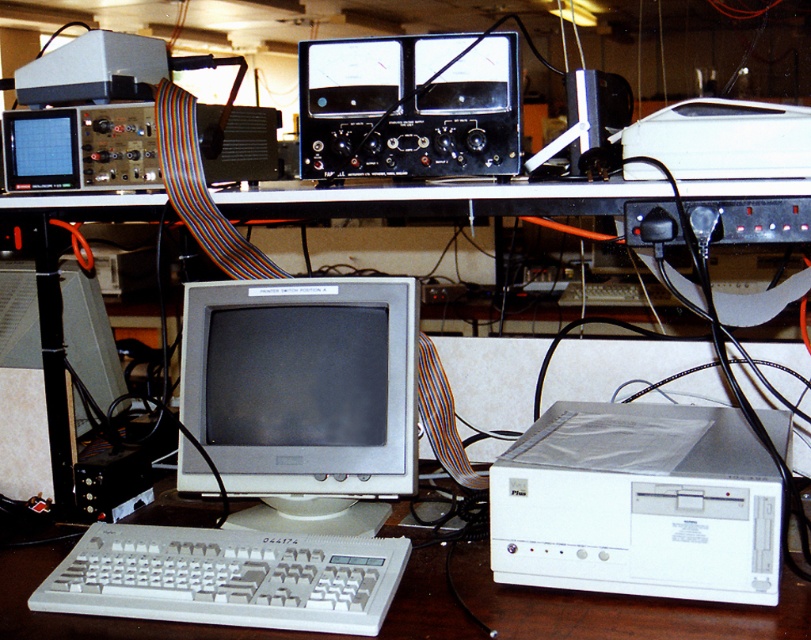
Question: Which point is farther from the camera taking this photo?

Choices:
 (A) (310, 305)
 (B) (490, 493)
 (C) (46, 577)

Answer: (A)

Question: Which object is positioned farthest from the white plastic computer at lower right?

Choices:
 (A) white plastic keyboard at lower left
 (B) matte gray monitor at center

Answer: (B)

Question: Estimate the real-world distances between objects in this image. Which object is farther from the white plastic keyboard at lower left?

Choices:
 (A) matte gray monitor at center
 (B) white plastic computer at lower right

Answer: (B)

Question: Is matte gray monitor at center positioned at the back of white plastic computer at lower right?

Choices:
 (A) yes
 (B) no

Answer: (A)

Question: Observing the image, what is the correct spatial positioning of white plastic computer at lower right in reference to white plastic keyboard at lower left?

Choices:
 (A) below
 (B) above

Answer: (B)

Question: Can you confirm if matte gray monitor at center is thinner than white plastic keyboard at lower left?

Choices:
 (A) yes
 (B) no

Answer: (A)